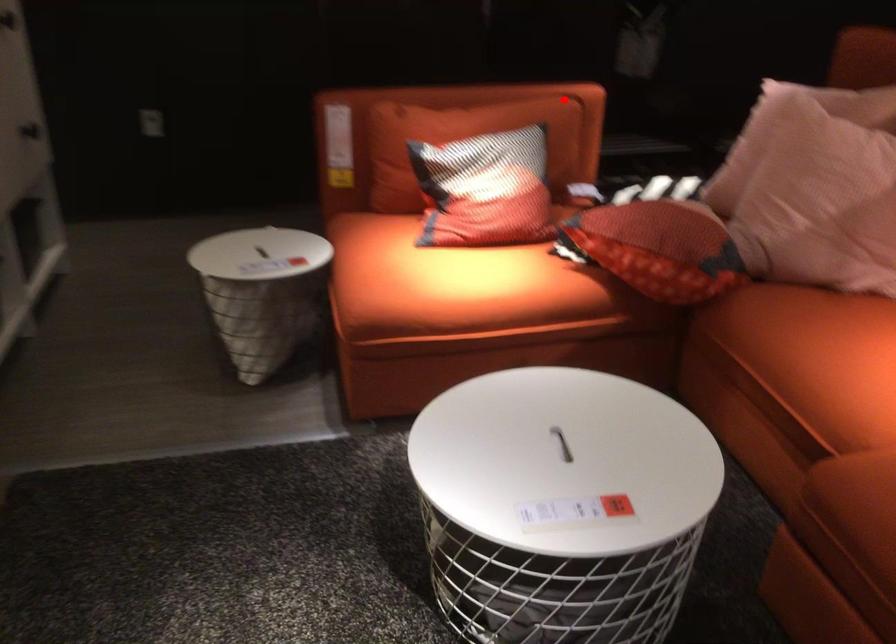
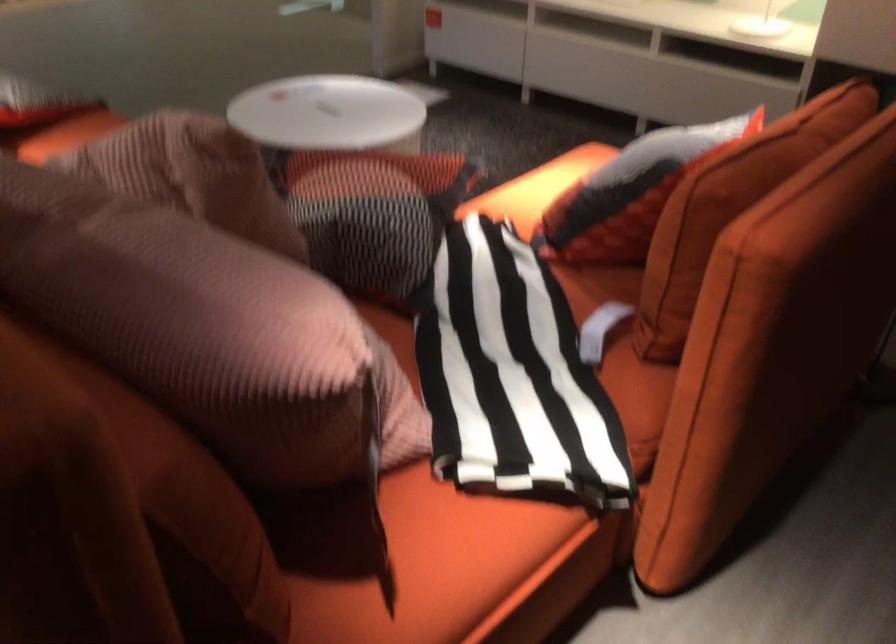
Question: A red point is marked in image1. In image2, is the corresponding 3D point closer to the camera or farther? Reply with the corresponding letter.

Choices:
 (A) The corresponding 3D point is closer.
 (B) The corresponding 3D point is farther.

Answer: (A)